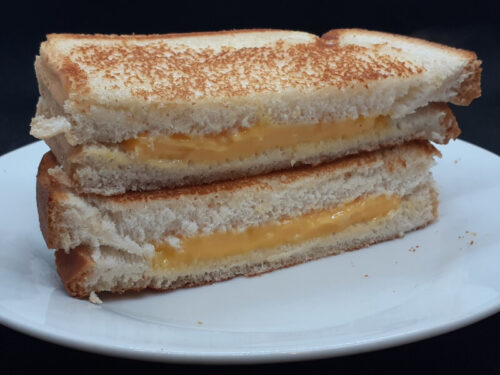
At what (x,y) coordinates should I click in order to perform the action: click on crumb. Please return your answer as a coordinate pair (x, y). Looking at the image, I should click on (471, 241).